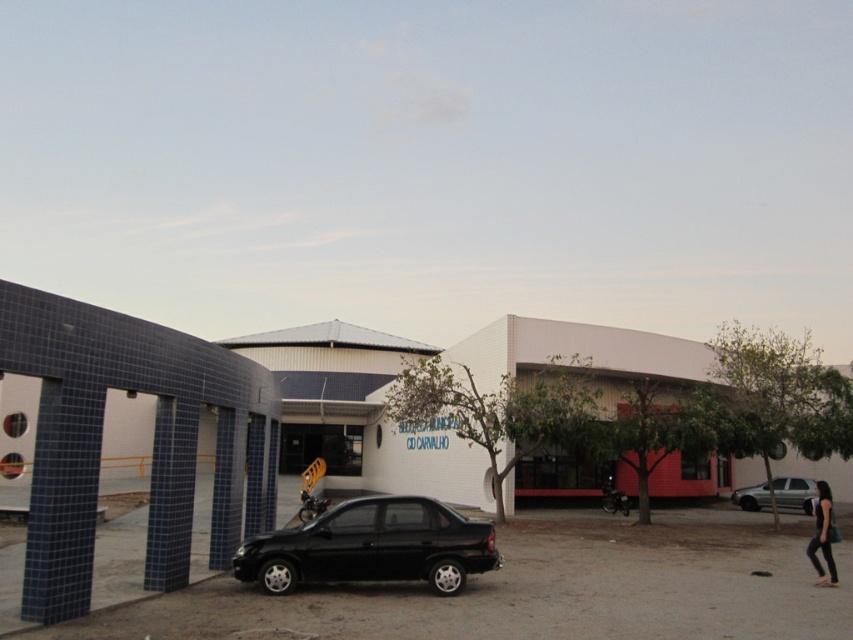
Question: Considering the real-world distances, which object is farthest from the silver metallic car at lower right?

Choices:
 (A) black fabric at lower right
 (B) black matte sedan at center

Answer: (B)

Question: Which object appears farthest from the camera in this image?

Choices:
 (A) black matte sedan at center
 (B) black fabric at lower right

Answer: (B)

Question: Is silver metallic car at lower right thinner than black fabric at lower right?

Choices:
 (A) no
 (B) yes

Answer: (B)

Question: Can you confirm if silver metallic car at lower right is positioned below black fabric at lower right?

Choices:
 (A) yes
 (B) no

Answer: (A)

Question: Which point is farther from the camera taking this photo?

Choices:
 (A) (805, 513)
 (B) (408, 557)

Answer: (A)

Question: Is silver metallic car at lower right thinner than black fabric at lower right?

Choices:
 (A) yes
 (B) no

Answer: (A)